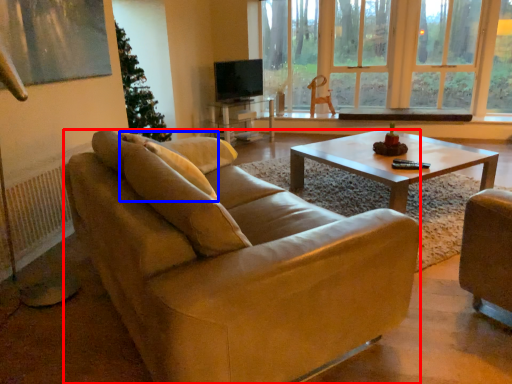
Question: Among these objects, which one is farthest to the camera, studio couch (highlighted by a red box) or pillow (highlighted by a blue box)?

Choices:
 (A) studio couch
 (B) pillow

Answer: (B)